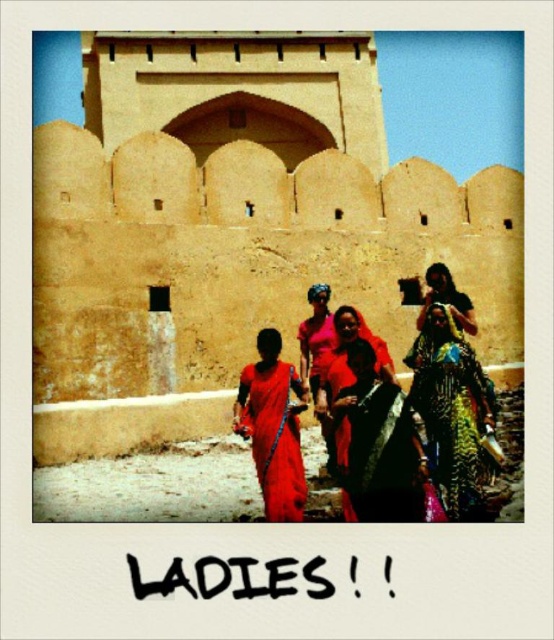
You are a photographer trying to capture the entire scene of the beige stone wall at center and the shiny gold dress at right in one frame. Considering their sizes, which object should you focus on to ensure both are visible without cropping?

Since the beige stone wall at center is taller than the shiny gold dress at right, you should focus on the beige stone wall at center to ensure both objects are fully visible in the frame.

Based on the photo, you are a photographer trying to capture the shiny gold dress at right in the frame. There is a point marked at coordinates (x=453, y=413) on the image. Where is this point located?

The point at coordinates (x=453, y=413) is located on the shiny gold dress at right.

You are a photographer standing in front of the fortification. You want to take a photo that includes both the point at coordinates point [54,188] and point [453,413]. Which point is closer to you, the photographer?

Point [54,188] is closer to you than point [453,413] because it is further to the viewer according to the description.